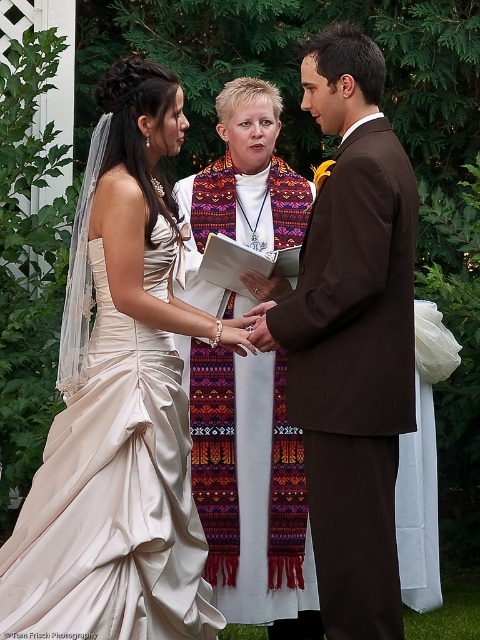
You are a photographer at the wedding ceremony. You want to focus on the point at point (85, 310) and point (317, 536). Which point is closer to the camera?

Point (85, 310) is further to the camera than point (317, 536), so point (317, 536) is closer to the camera.